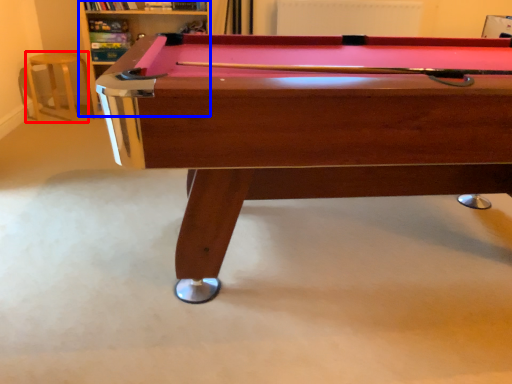
Question: Which of the following is the farthest to the observer, bar stool (highlighted by a red box) or shelf (highlighted by a blue box)?

Choices:
 (A) bar stool
 (B) shelf

Answer: (A)